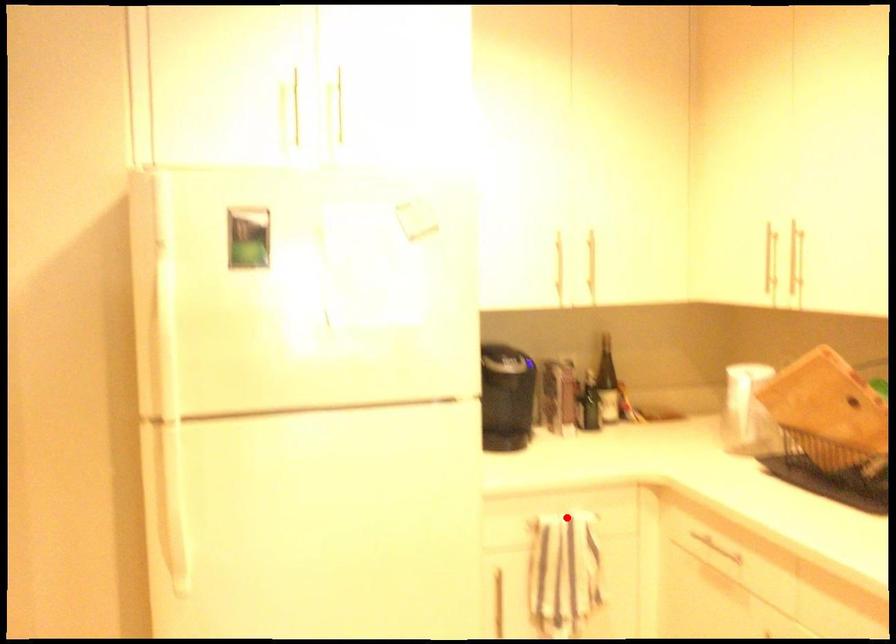
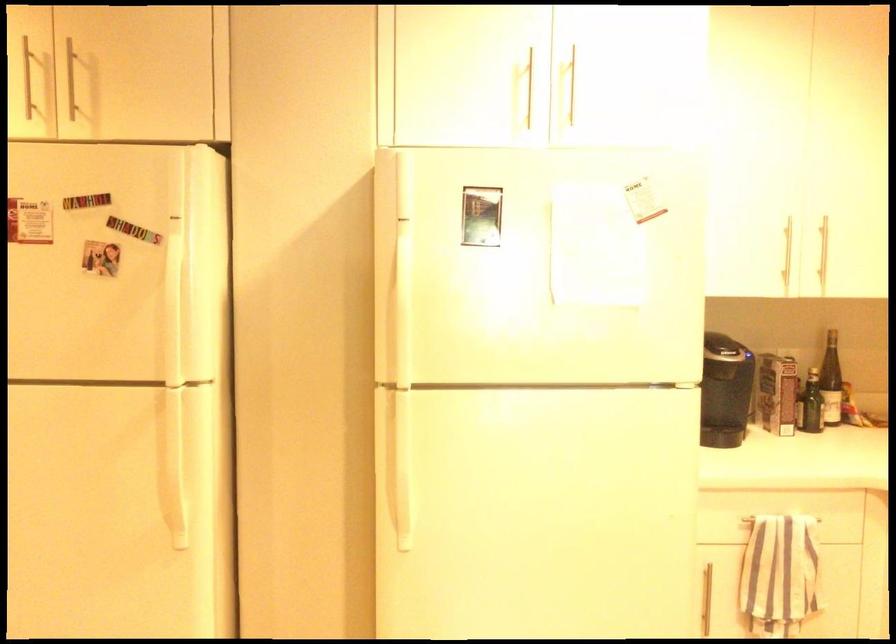
Question: I am providing you with two images of the same scene from different viewpoints. A red point is marked on the first image. Is the red point's position out of view in image 2?

Choices:
 (A) Yes
 (B) No

Answer: (B)